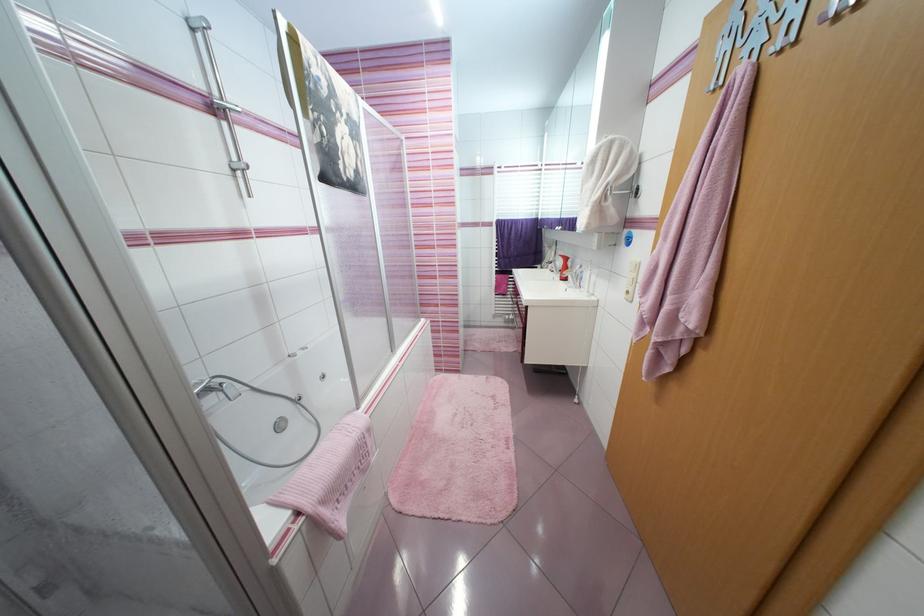
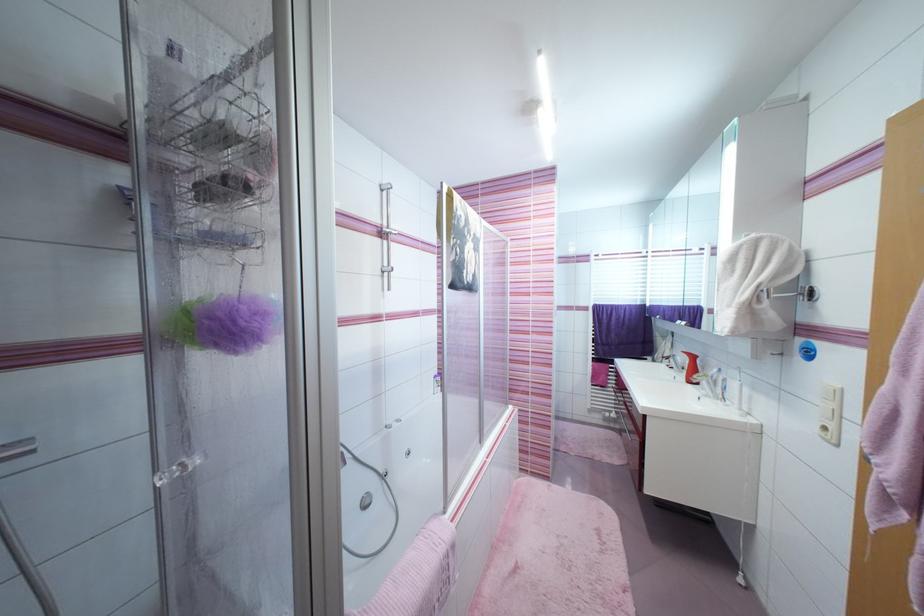
Locate, in the second image, the point that corresponds to (314,422) in the first image.

(395, 504)